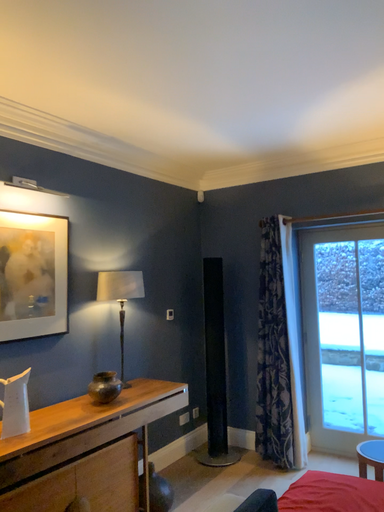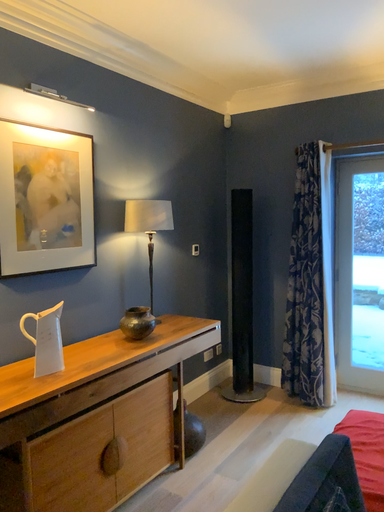
Question: How did the camera likely rotate when shooting the video?

Choices:
 (A) rotated upward
 (B) rotated downward

Answer: (B)